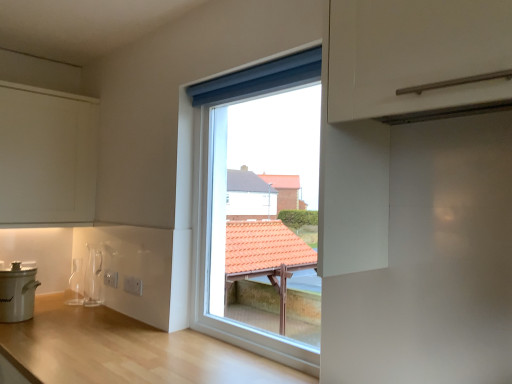
Locate an element on the screen. The height and width of the screenshot is (384, 512). vacant space situated above light wood countertop at center (from a real-world perspective) is located at coordinates (96, 331).